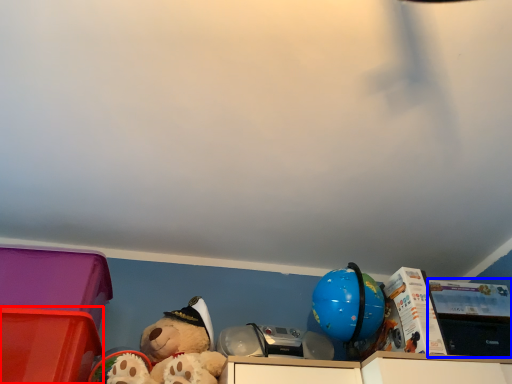
Question: Among these objects, which one is farthest to the camera, storage box (highlighted by a red box) or storage box (highlighted by a blue box)?

Choices:
 (A) storage box
 (B) storage box

Answer: (B)